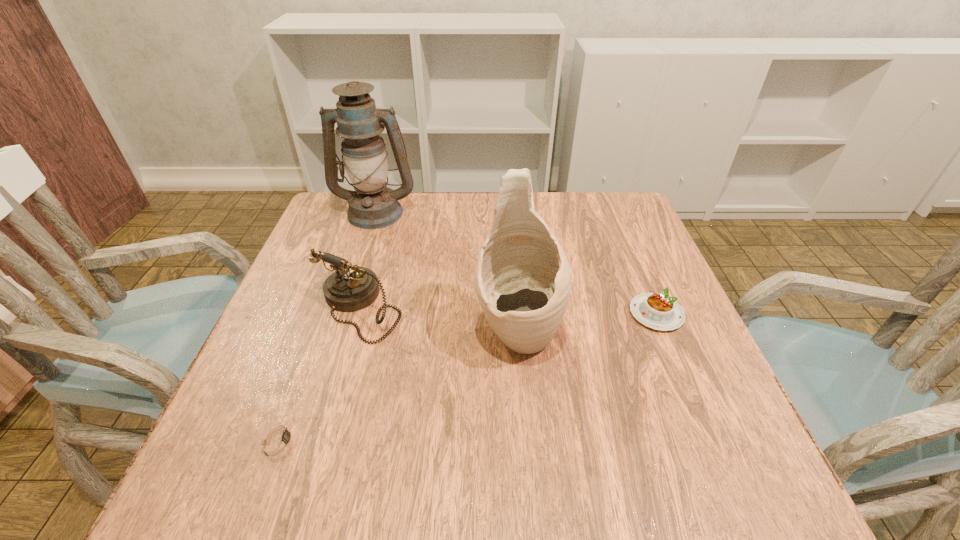
The height and width of the screenshot is (540, 960). I want to click on blank area located on the left of the second shortest object, so click(491, 314).

You are a GUI agent. You are given a task and a screenshot of the screen. Output one action in this format:
    pyautogui.click(x=<x>, y=<y>)
    Task: Click on the free spot located 0.330m on the face of the shortest object
    The height and width of the screenshot is (540, 960).
    Given the screenshot: What is the action you would take?
    pyautogui.click(x=505, y=440)

Locate an element on the screen. This screenshot has height=540, width=960. object that is at the far edge is located at coordinates (372, 205).

Where is `object that is at the near edge`? The width and height of the screenshot is (960, 540). object that is at the near edge is located at coordinates (279, 439).

The height and width of the screenshot is (540, 960). Find the location of `oil lamp that is at the left edge`. oil lamp that is at the left edge is located at coordinates (372, 205).

At what (x,y) coordinates should I click in order to perform the action: click on telephone located in the left edge section of the desktop. Please return your answer as a coordinate pair (x, y). The image size is (960, 540). Looking at the image, I should click on (350, 288).

Image resolution: width=960 pixels, height=540 pixels. I want to click on watch present at the left edge, so click(279, 439).

Find the location of `object at the right edge`. object at the right edge is located at coordinates pos(657,311).

The image size is (960, 540). What are the coordinates of `object positioned at the far left corner` in the screenshot? It's located at (372, 205).

The image size is (960, 540). In order to click on object present at the near left corner in this screenshot , I will do `click(279, 439)`.